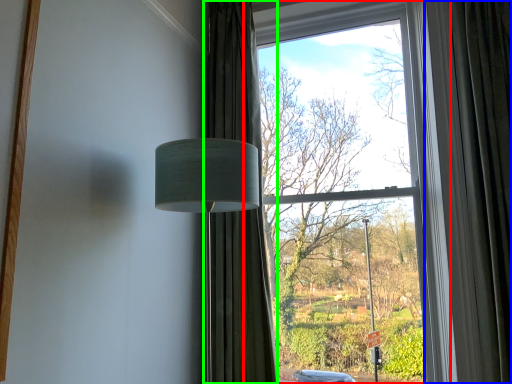
Question: Which object is positioned farthest from window (highlighted by a red box)? Select from curtain (highlighted by a blue box) and curtain (highlighted by a green box).

Choices:
 (A) curtain
 (B) curtain

Answer: (B)